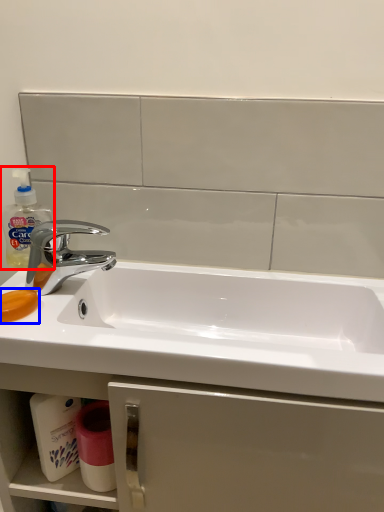
Question: Among these objects, which one is nearest to the camera, cleaning product (highlighted by a red box) or soap (highlighted by a blue box)?

Choices:
 (A) cleaning product
 (B) soap

Answer: (B)